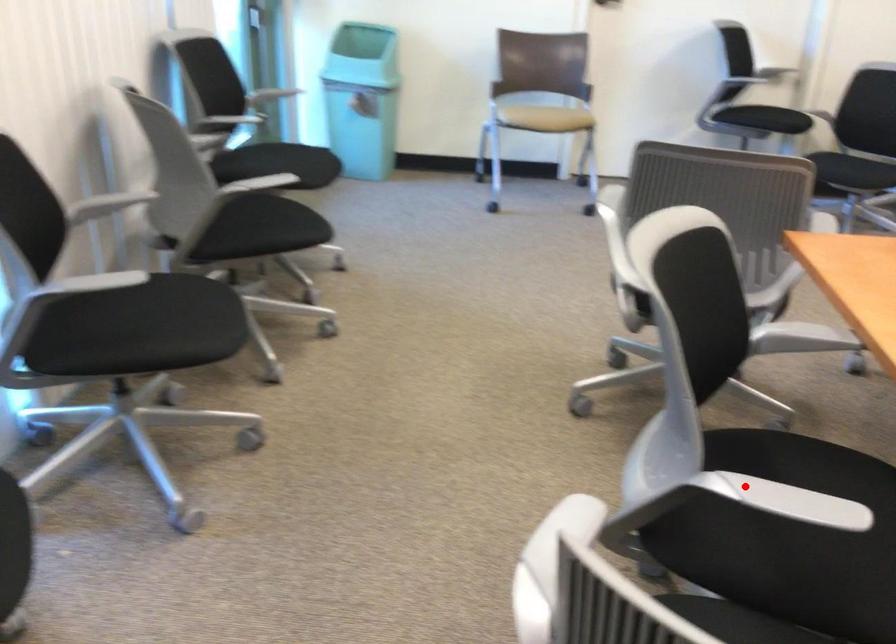
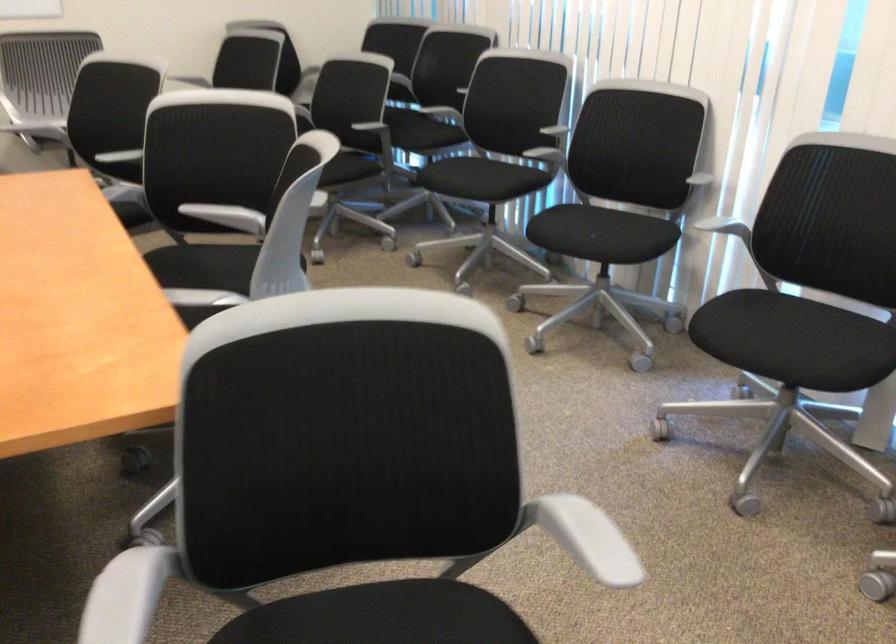
Where in the second image is the point corresponding to the highlighted location from the first image?

(208, 212)